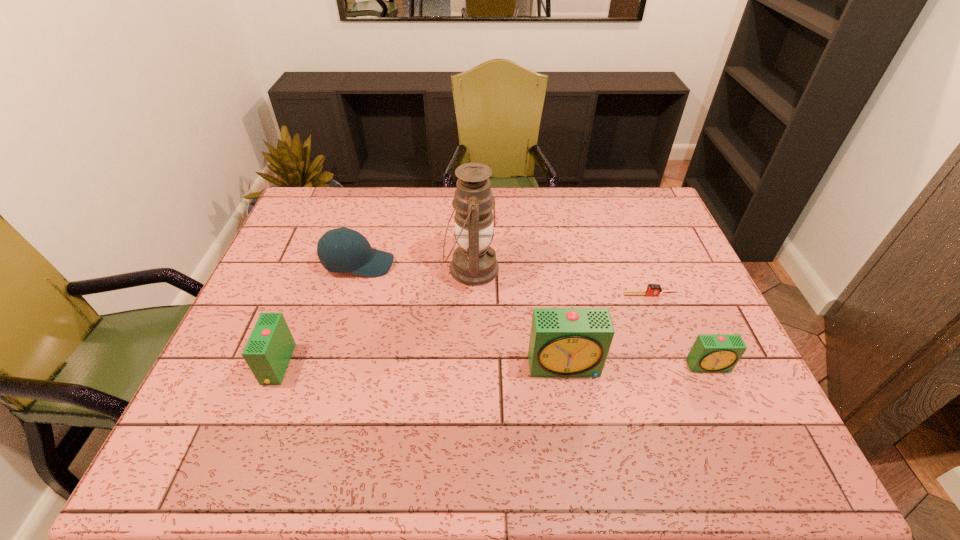
The width and height of the screenshot is (960, 540). Identify the location of free space located 0.090m on the front-facing side of the tallest alarm clock. (573, 413).

Locate an element on the screen. This screenshot has width=960, height=540. free space located 0.090m on the front-facing side of the rightmost alarm clock is located at coordinates click(728, 408).

What are the coordinates of `free region located on the left of the tallest object` in the screenshot? It's located at (334, 268).

The image size is (960, 540). Identify the location of vacant space located on the front-facing side of the baseball cap. (496, 264).

This screenshot has height=540, width=960. What are the coordinates of `vacant point located 0.400m on the left of the tape measure` in the screenshot? It's located at (482, 295).

Locate an element on the screen. object present at the near edge is located at coordinates 268,351.

Identify the location of alarm clock situated at the left edge. The image size is (960, 540). (268, 351).

You are a GUI agent. You are given a task and a screenshot of the screen. Output one action in this format:
    pyautogui.click(x=<x>, y=<y>)
    Task: Click on the baseball cap present at the left edge
    
    Given the screenshot: What is the action you would take?
    pyautogui.click(x=342, y=250)

The height and width of the screenshot is (540, 960). I want to click on alarm clock positioned at the right edge, so click(x=711, y=353).

The width and height of the screenshot is (960, 540). I want to click on tape measure at the right edge, so click(x=652, y=289).